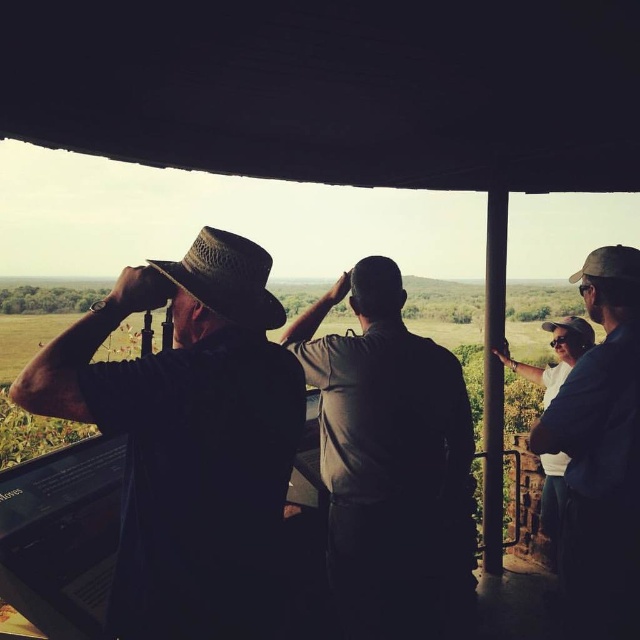
Between point (134, 362) and point (621, 513), which one is positioned in front?

Point (134, 362) is more forward.

Is straw hat at left bigger than dark blue shirt at right?

Incorrect, straw hat at left is not larger than dark blue shirt at right.

Describe the element at coordinates (188, 438) in the screenshot. I see `straw hat at left` at that location.

Find the location of a particular element. This screenshot has height=640, width=640. straw hat at left is located at coordinates (188, 438).

Does dark brown uniform at center appear on the right side of dark blue shirt at right?

Incorrect, dark brown uniform at center is not on the right side of dark blue shirt at right.

Between dark brown uniform at center and dark blue shirt at right, which one has more height?

With more height is dark brown uniform at center.

Which is behind, point (371, 532) or point (564, 552)?

Point (564, 552)

Find the location of a particular element. The image size is (640, 640). dark brown uniform at center is located at coordinates (390, 464).

Is dark blue shirt at right shorter than white cotton shirt at right?

No.

Is point (618, 596) in front of point (561, 369)?

That is True.

I want to click on dark blue shirt at right, so click(x=600, y=452).